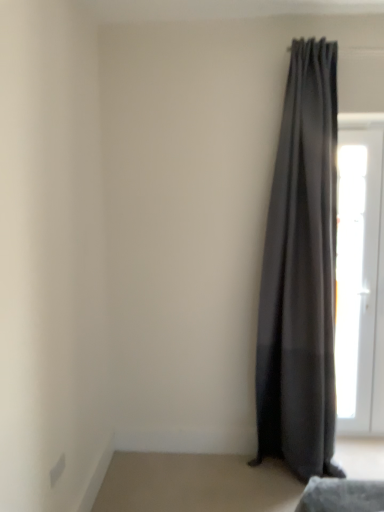
I want to click on vacant region to the left of dark gray sheer curtain at right, so click(x=229, y=479).